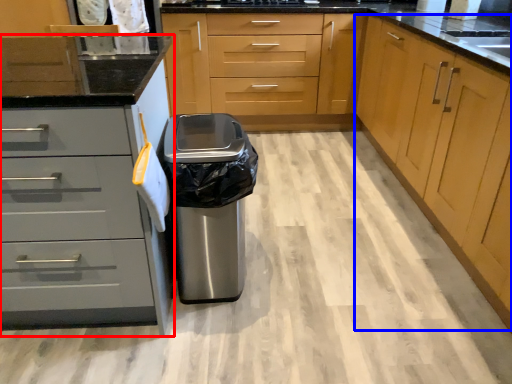
Question: Which object is closer to the camera taking this photo, cabinetry (highlighted by a red box) or cabinetry (highlighted by a blue box)?

Choices:
 (A) cabinetry
 (B) cabinetry

Answer: (B)